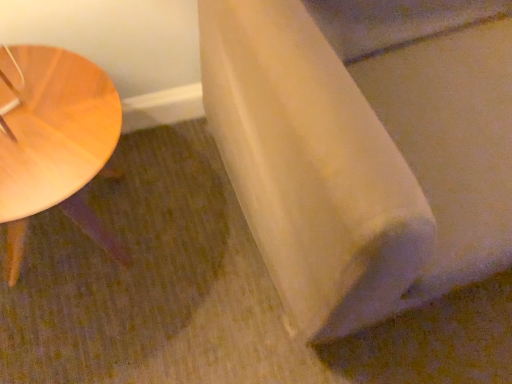
Question: Is light wood table at left oriented away from white matte fabric at lower right?

Choices:
 (A) no
 (B) yes

Answer: (A)

Question: Considering the relative sizes of light wood table at left and white matte fabric at lower right in the image provided, is light wood table at left shorter than white matte fabric at lower right?

Choices:
 (A) no
 (B) yes

Answer: (B)

Question: Does light wood table at left contain white matte fabric at lower right?

Choices:
 (A) no
 (B) yes

Answer: (A)

Question: Is light wood table at left at the right side of white matte fabric at lower right?

Choices:
 (A) yes
 (B) no

Answer: (B)

Question: Is light wood table at left aimed at white matte fabric at lower right?

Choices:
 (A) yes
 (B) no

Answer: (B)

Question: Is light wood table at left thinner than white matte fabric at lower right?

Choices:
 (A) no
 (B) yes

Answer: (B)

Question: From a real-world perspective, is white matte fabric at lower right positioned over light wood table at left based on gravity?

Choices:
 (A) yes
 (B) no

Answer: (A)

Question: Is light wood table at left at the back of white matte fabric at lower right?

Choices:
 (A) no
 (B) yes

Answer: (A)

Question: Is white matte fabric at lower right positioned in front of light wood table at left?

Choices:
 (A) yes
 (B) no

Answer: (A)

Question: Considering the relative sizes of white matte fabric at lower right and light wood table at left in the image provided, is white matte fabric at lower right smaller than light wood table at left?

Choices:
 (A) no
 (B) yes

Answer: (A)

Question: Can you confirm if white matte fabric at lower right is positioned to the left of light wood table at left?

Choices:
 (A) yes
 (B) no

Answer: (B)

Question: Does white matte fabric at lower right appear on the right side of light wood table at left?

Choices:
 (A) yes
 (B) no

Answer: (A)

Question: Relative to white matte fabric at lower right, is light wood table at left in front or behind?

Choices:
 (A) front
 (B) behind

Answer: (B)